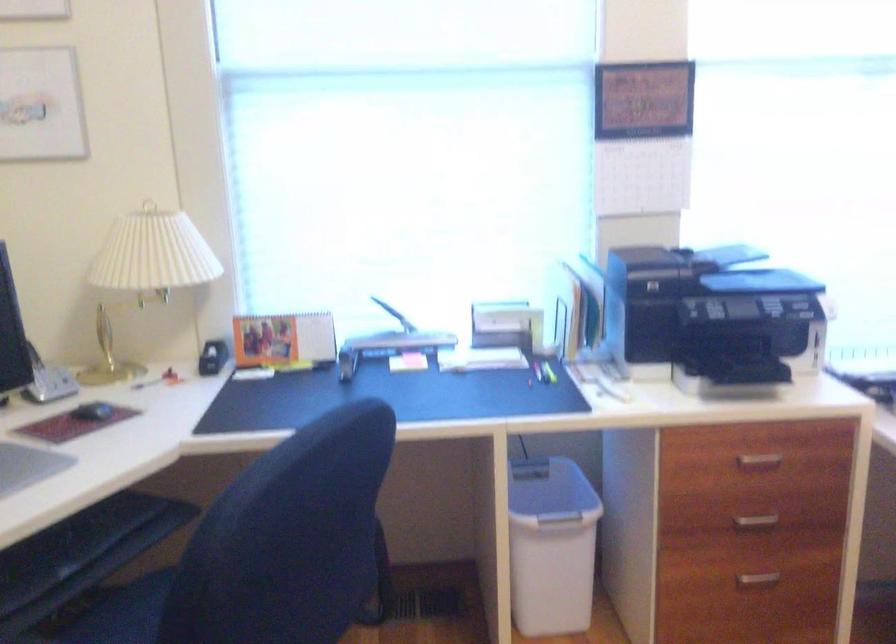
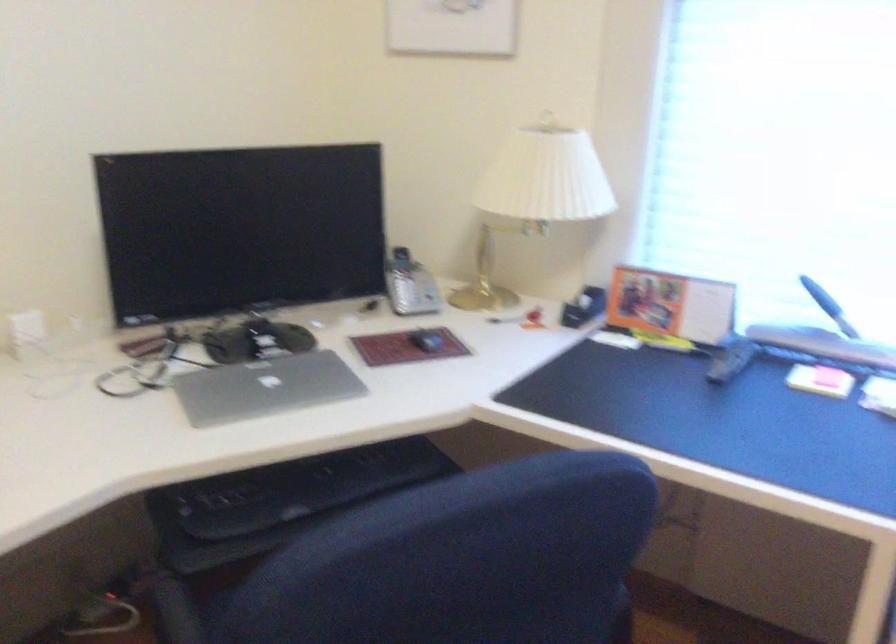
Where in the second image is the point corresponding to [97,415] from the first image?

(426, 341)